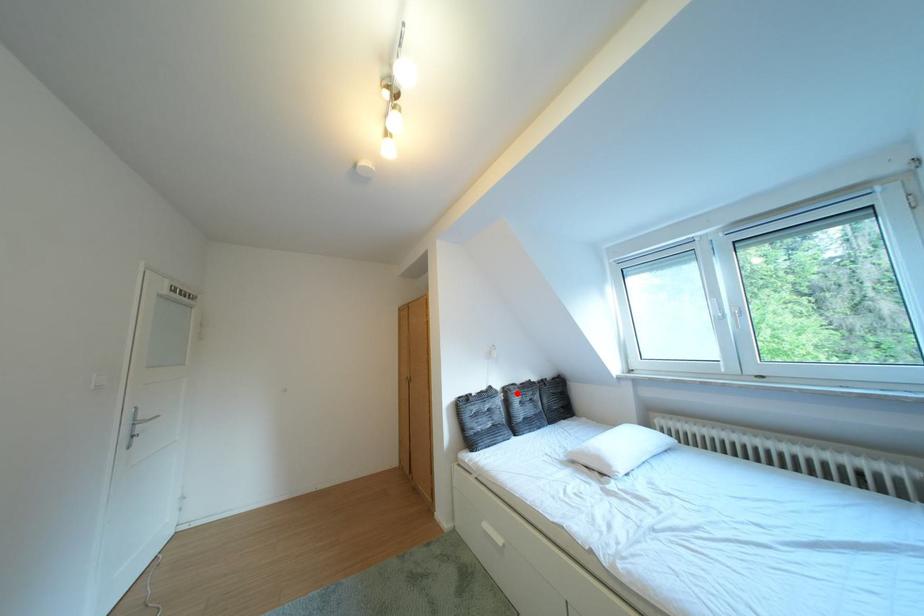
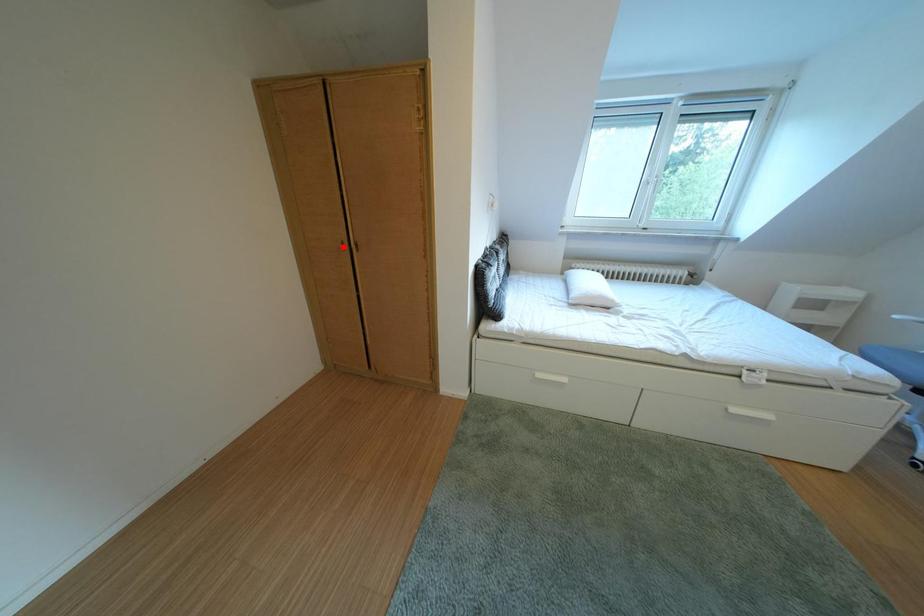
I am providing you with two images of the same scene from different viewpoints. A red point is marked on the first image and another point is marked on the second image. Do the highlighted points in image1 and image2 indicate the same real-world spot?

No